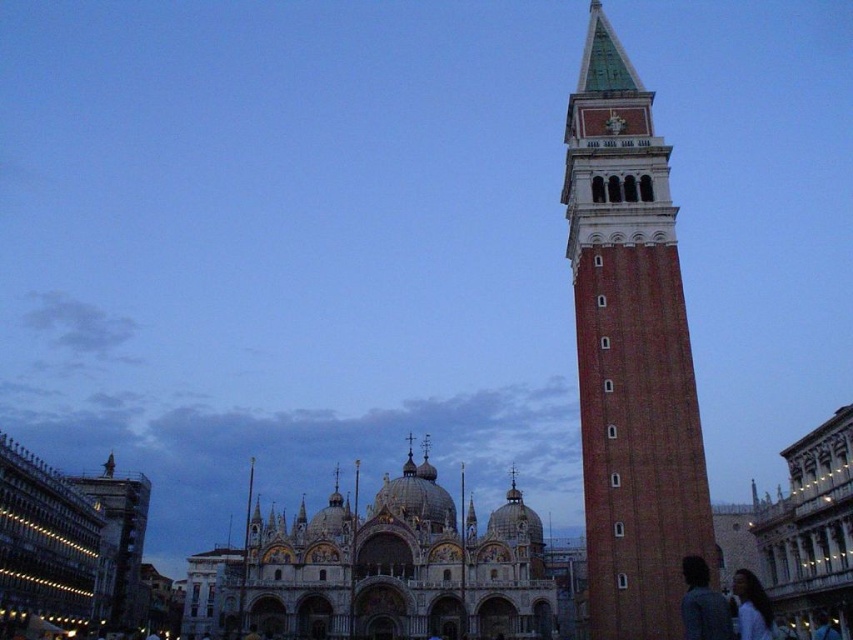
You are an architect visiting Venice and notice the white marble cathedral at center and the white matte shirt at lower right in the scene. Which object appears bigger in the image?

The white marble cathedral at center appears bigger in the image compared to the white matte shirt at lower right as it has a larger size.

You are a tourist in Venice and want to take a photo of the Campanile di San Marco. You notice a point marked at coordinates (630,353) in the image. Is this point located on the Campanile di San Marco or somewhere else?

The point at coordinates (630,353) corresponds to the brick tower at right, which is the Campanile di San Marco. Therefore, the point is located on the Campanile di San Marco.

You are a tourist in Venice and want to take a photo of the white marble cathedral at center and the dark hair at center. Which object should you focus on first if you want to capture both in a single frame without moving the camera?

The white marble cathedral at center has a larger size compared to dark hair at center, so you should focus on the white marble cathedral at center first to ensure it is in clear view before adjusting for the smaller dark hair at center.